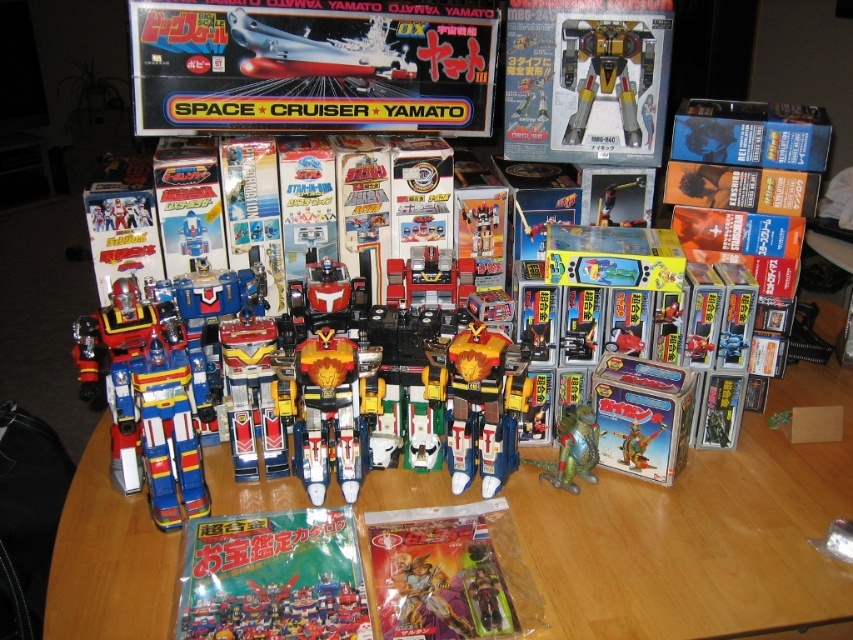
Is metallic yellow robot at center positioned at the back of shiny plastic robots at center?

No.

Which is in front, point (553, 52) or point (97, 36)?

Point (553, 52) is more forward.

Locate an element on the screen. metallic yellow robot at center is located at coordinates (585, 80).

Who is shorter, wooden table at center or metallic yellow robot at center?

Standing shorter between the two is metallic yellow robot at center.

Is wooden table at center below metallic yellow robot at center?

Indeed, wooden table at center is positioned under metallic yellow robot at center.

At what (x,y) coordinates should I click in order to perform the action: click on wooden table at center. Please return your answer as a coordinate pair (x, y). Looking at the image, I should click on (700, 536).

Is wooden table at center thinner than matte green plastic comic book at lower center?

In fact, wooden table at center might be wider than matte green plastic comic book at lower center.

Which of these two, wooden table at center or matte green plastic comic book at lower center, stands shorter?

With less height is matte green plastic comic book at lower center.

Which is behind, point (848, 582) or point (305, 620)?

The point (848, 582) is behind.

This screenshot has height=640, width=853. I want to click on wooden table at center, so click(700, 536).